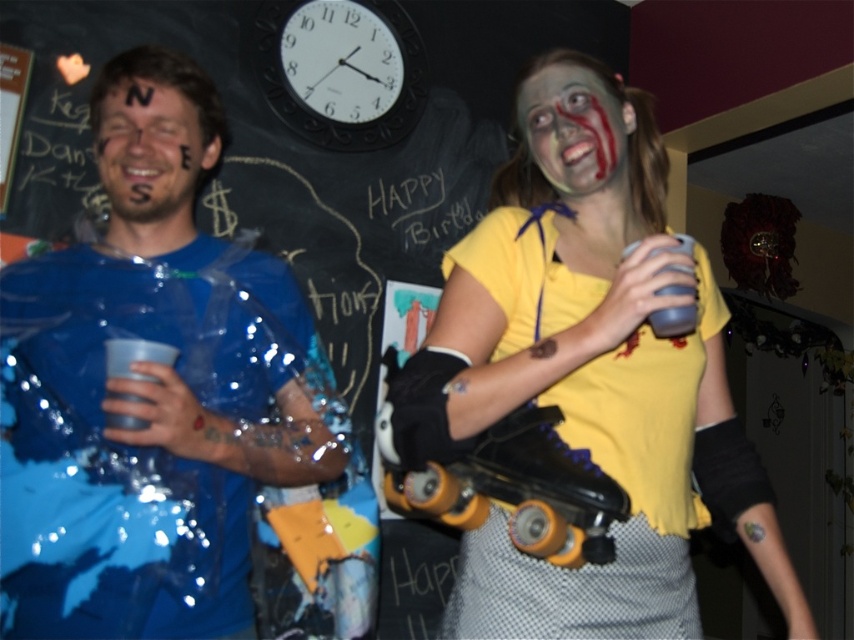
You are at the party and want to grab the blue shiny plastic cup at left. Where should you look?

The blue shiny plastic cup at left is located at point (139, 486).

You are at the party and want to take a photo of both the point at (79, 344) and the point at (525, 552) in the background. Which point should you focus on first to ensure both are in the frame?

You should focus on the point at (525, 552) first because it is in front of the point at (79, 344). By focusing on the closer point, you can adjust the camera to include both in the frame.